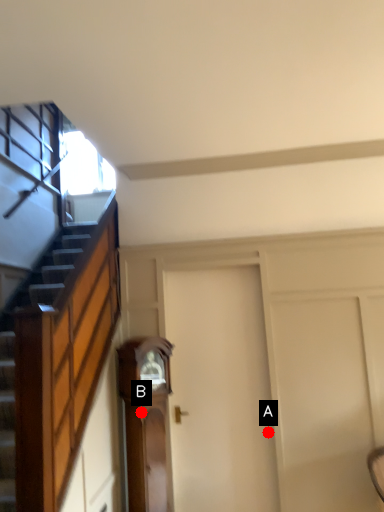
Question: Two points are circled on the image, labeled by A and B beside each circle. Which point appears farthest from the camera in this image?

Choices:
 (A) A is further
 (B) B is further

Answer: (A)